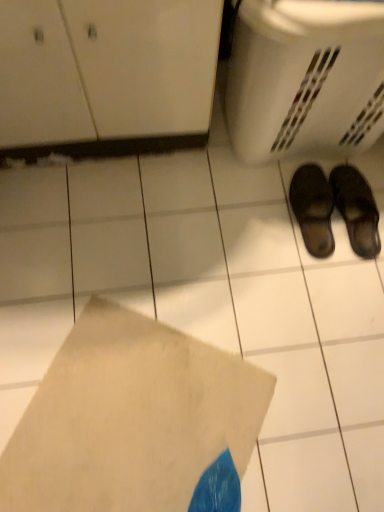
Question: Is white matte envelope at lower center bigger than leather slipper at lower right, arranged as the first footwear when viewed from the right?

Choices:
 (A) no
 (B) yes

Answer: (B)

Question: Considering the relative sizes of white matte envelope at lower center and leather slipper at lower right, arranged as the first footwear when viewed from the right, in the image provided, is white matte envelope at lower center wider than leather slipper at lower right, arranged as the first footwear when viewed from the right,?

Choices:
 (A) yes
 (B) no

Answer: (A)

Question: Does white matte envelope at lower center have a lesser width compared to leather slipper at lower right, the second footwear when ordered from left to right?

Choices:
 (A) no
 (B) yes

Answer: (A)

Question: Is white matte envelope at lower center looking in the opposite direction of leather slipper at lower right, arranged as the first footwear when viewed from the right?

Choices:
 (A) yes
 (B) no

Answer: (B)

Question: Is white matte envelope at lower center closer to camera compared to leather slipper at lower right, arranged as the first footwear when viewed from the right?

Choices:
 (A) yes
 (B) no

Answer: (A)

Question: From the image's perspective, is leather slipper at lower right, the second footwear when ordered from left to right, above or below white matte envelope at lower center?

Choices:
 (A) below
 (B) above

Answer: (B)

Question: Is point (321, 240) positioned closer to the camera than point (105, 457)?

Choices:
 (A) farther
 (B) closer

Answer: (A)

Question: Considering the positions of leather slipper at lower right, arranged as the first footwear when viewed from the right, and white matte envelope at lower center in the image, is leather slipper at lower right, arranged as the first footwear when viewed from the right, bigger or smaller than white matte envelope at lower center?

Choices:
 (A) small
 (B) big

Answer: (A)

Question: Is leather slipper at lower right, the second footwear when ordered from left to right, in front of or behind white matte envelope at lower center in the image?

Choices:
 (A) behind
 (B) front

Answer: (A)

Question: Considering the positions of white matte envelope at lower center and black leather slippers at lower right, which ranks as the second footwear in right-to-left order, in the image, is white matte envelope at lower center wider or thinner than black leather slippers at lower right, which ranks as the second footwear in right-to-left order,?

Choices:
 (A) wide
 (B) thin

Answer: (A)

Question: From a real-world perspective, is white matte envelope at lower center positioned above or below black leather slippers at lower right, which ranks as the second footwear in right-to-left order?

Choices:
 (A) above
 (B) below

Answer: (B)

Question: Considering the positions of white matte envelope at lower center and black leather slippers at lower right, which is the 1th footwear from left to right, in the image, is white matte envelope at lower center bigger or smaller than black leather slippers at lower right, which is the 1th footwear from left to right,?

Choices:
 (A) small
 (B) big

Answer: (B)

Question: Based on their positions, is white matte envelope at lower center located to the left or right of black leather slippers at lower right, which is the 1th footwear from left to right?

Choices:
 (A) left
 (B) right

Answer: (A)

Question: In terms of width, does white plastic basket at lower right look wider or thinner when compared to black leather slippers at lower right, which ranks as the second footwear in right-to-left order?

Choices:
 (A) thin
 (B) wide

Answer: (B)

Question: Considering the positions of white plastic basket at lower right and black leather slippers at lower right, which is the 1th footwear from left to right, in the image, is white plastic basket at lower right bigger or smaller than black leather slippers at lower right, which is the 1th footwear from left to right,?

Choices:
 (A) big
 (B) small

Answer: (A)